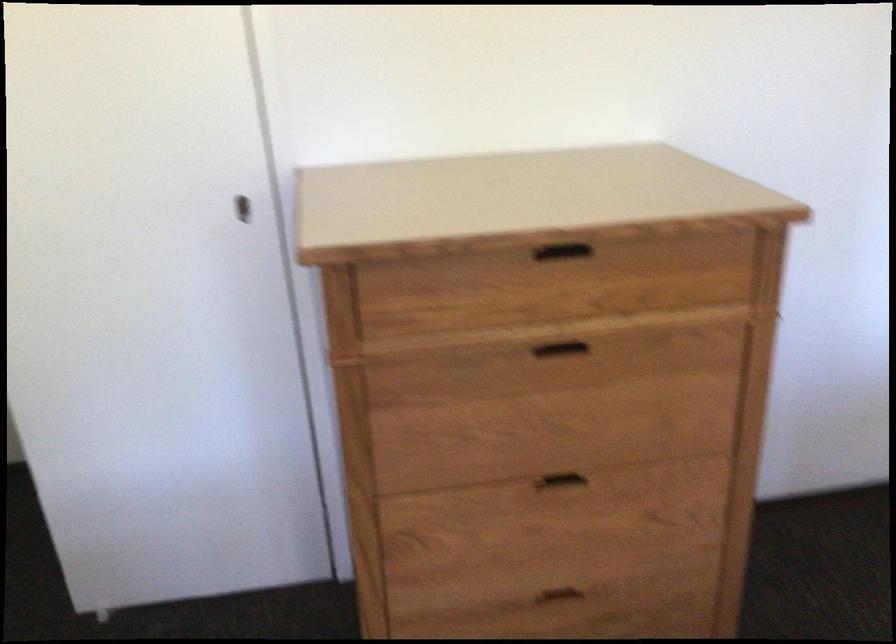
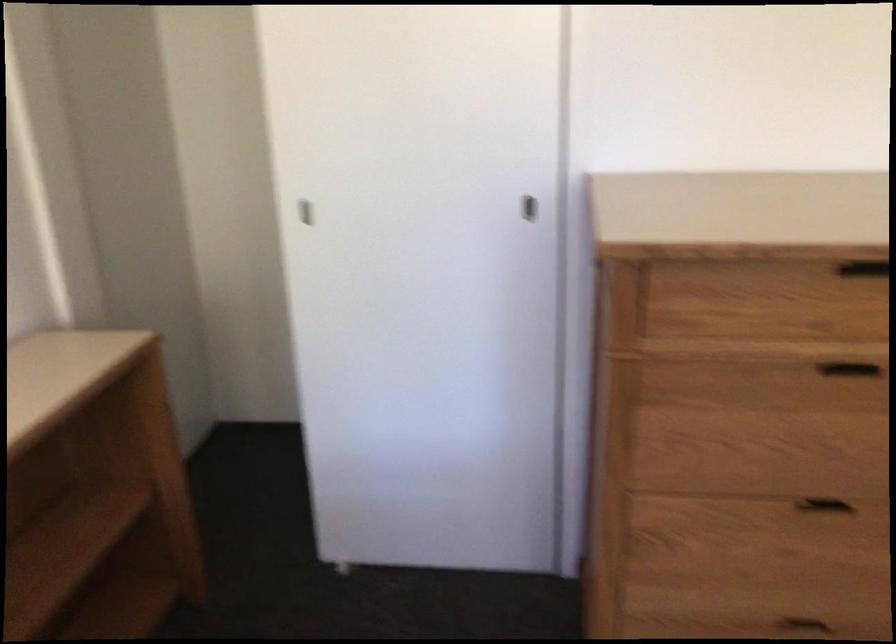
Question: The camera is either moving clockwise (left) or counter-clockwise (right) around the object. The first image is from the beginning of the video and the second image is from the end. Is the camera moving left or right when shooting the video?

Choices:
 (A) Left
 (B) Right

Answer: (B)